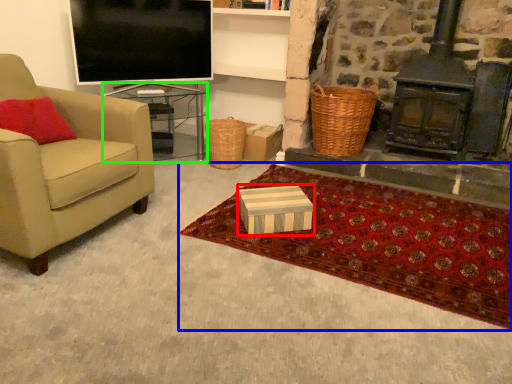
Question: Estimate the real-world distances between objects in this image. Which object is farther from box (highlighted by a red box), mat (highlighted by a blue box) or table (highlighted by a green box)?

Choices:
 (A) mat
 (B) table

Answer: (B)